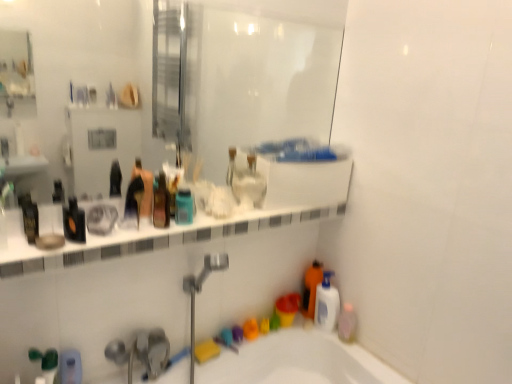
Image resolution: width=512 pixels, height=384 pixels. In order to click on blank space situated above white glossy ledge at upper center (from a real-world perspective) in this screenshot , I will do `click(175, 226)`.